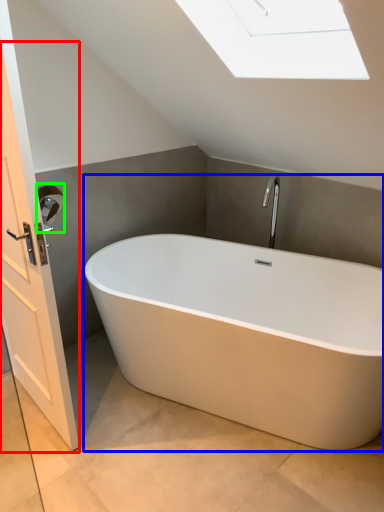
Question: Which object is the farthest from screen door (highlighted by a red box)? Choose among these: bathtub (highlighted by a blue box) or towel bar (highlighted by a green box).

Choices:
 (A) bathtub
 (B) towel bar

Answer: (A)